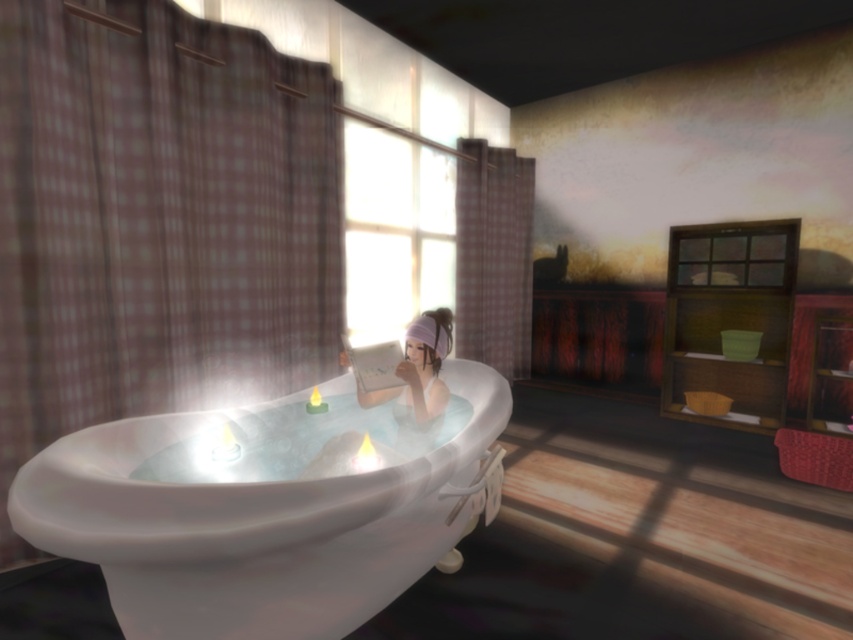
Question: Can you confirm if white glossy bathtub at center is wider than white glossy hairband at center?

Choices:
 (A) yes
 (B) no

Answer: (A)

Question: Does white glossy bathtub at center have a larger size compared to white glossy hairband at center?

Choices:
 (A) yes
 (B) no

Answer: (A)

Question: Which point is farther to the camera?

Choices:
 (A) (447, 358)
 (B) (422, 339)

Answer: (A)

Question: Which point appears closest to the camera in this image?

Choices:
 (A) (444, 323)
 (B) (215, 616)

Answer: (B)

Question: Does white glossy bathtub at center have a larger size compared to white glossy hairband at center?

Choices:
 (A) yes
 (B) no

Answer: (A)